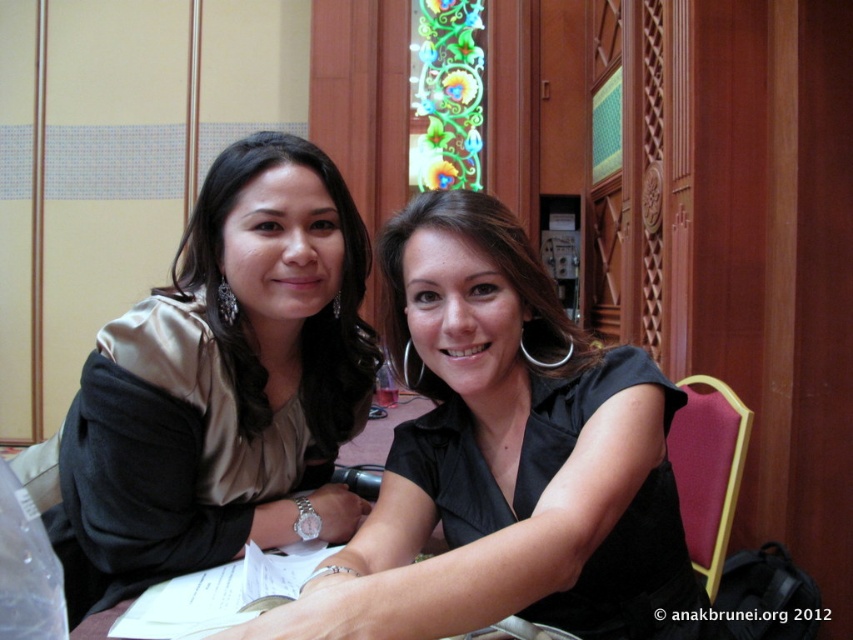
Question: Can you confirm if matte gold blouse at left is positioned below black matte shirt at center?

Choices:
 (A) yes
 (B) no

Answer: (A)

Question: Which of the following is the farthest from the observer?

Choices:
 (A) black matte shirt at center
 (B) stained glass window at upper center
 (C) matte gold blouse at center
 (D) satin beige blouse at left

Answer: (B)

Question: Is matte gold blouse at center thinner than satin beige blouse at left?

Choices:
 (A) yes
 (B) no

Answer: (B)

Question: Which object is closer to the camera taking this photo?

Choices:
 (A) stained glass window at upper center
 (B) satin beige blouse at left

Answer: (B)

Question: Which is farther from the black matte shirt at center?

Choices:
 (A) matte gold blouse at left
 (B) matte gold blouse at center
 (C) satin beige blouse at left
 (D) stained glass window at upper center

Answer: (D)

Question: Can you confirm if satin beige blouse at left is bigger than stained glass window at upper center?

Choices:
 (A) yes
 (B) no

Answer: (A)